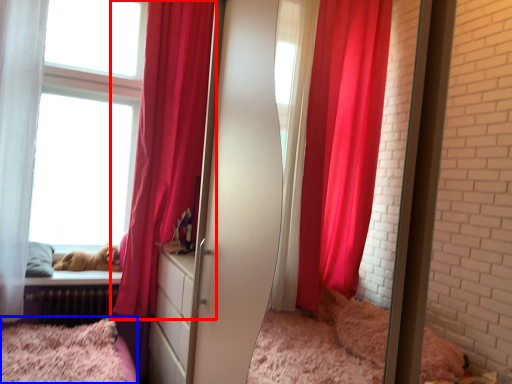
Question: Among these objects, which one is farthest to the camera, curtain (highlighted by a red box) or bed (highlighted by a blue box)?

Choices:
 (A) curtain
 (B) bed

Answer: (A)